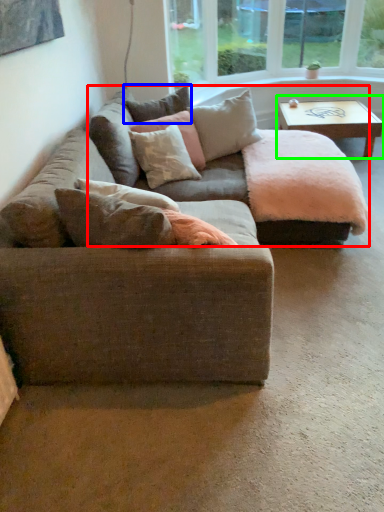
Question: Which object is the closest to the couch (highlighted by a red box)? Choose among these: pillow (highlighted by a blue box) or coffee table (highlighted by a green box).

Choices:
 (A) pillow
 (B) coffee table

Answer: (A)